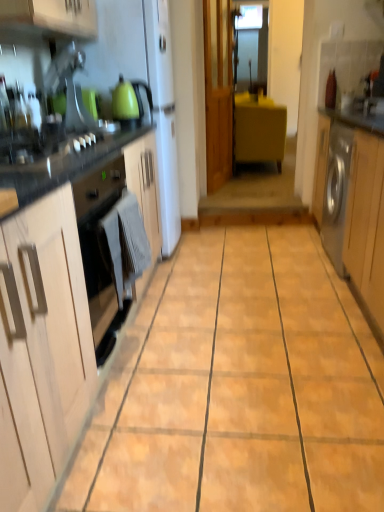
Question: In terms of size, does light wood cabinet at left, marked as the third cabinetry in a top-to-bottom arrangement, appear bigger or smaller than matte green kettle at upper left?

Choices:
 (A) small
 (B) big

Answer: (B)

Question: Do you think light wood cabinet at left, which appears as the first cabinetry when ordered from the bottom, is within matte green kettle at upper left, or outside of it?

Choices:
 (A) outside
 (B) inside

Answer: (A)

Question: Considering the real-world distances, which object is farthest from the yellow matte cabinet at center, the first cabinetry viewed from the back?

Choices:
 (A) gray fabric towel at lower left
 (B) light wood cabinet at left, which is the 1th cabinetry from left to right
 (C) silver metallic washing machine at right, which is counted as the first cabinetry, starting from the right
 (D) matte green kettle at upper left

Answer: (B)

Question: Which object is the farthest from the light wood cabinet at left, marked as the third cabinetry in a top-to-bottom arrangement?

Choices:
 (A) yellow matte cabinet at center, acting as the 3th cabinetry starting from the bottom
 (B) matte green kettle at upper left
 (C) gray fabric towel at lower left
 (D) silver metallic washing machine at right, the 3th cabinetry from the left

Answer: (A)